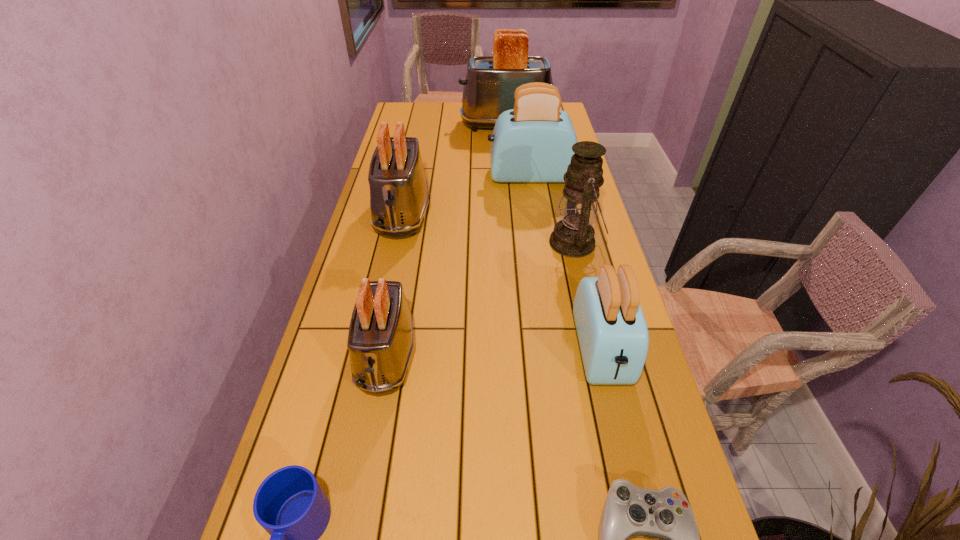
The height and width of the screenshot is (540, 960). Find the location of `the farthest gray toaster`. the farthest gray toaster is located at coordinates (491, 81).

At what (x,y) coordinates should I click in order to perform the action: click on the rightmost gray toaster. Please return your answer as a coordinate pair (x, y). The width and height of the screenshot is (960, 540). Looking at the image, I should click on (491, 81).

Find the location of a particular element. This screenshot has width=960, height=540. green oil lamp is located at coordinates click(573, 236).

The height and width of the screenshot is (540, 960). In order to click on the bigger light toaster in this screenshot , I will do `click(533, 142)`.

Locate an element on the screen. the second biggest gray toaster is located at coordinates (399, 196).

This screenshot has width=960, height=540. I want to click on the smaller light toaster, so pyautogui.click(x=613, y=336).

Where is `the smallest gray toaster`? the smallest gray toaster is located at coordinates (380, 341).

In order to click on vacant space located 0.080m on the side of the rightmost gray toaster with the control lever in this screenshot , I will do `click(442, 125)`.

Identify the location of blank space located on the side of the rightmost gray toaster with the control lever. (433, 125).

Where is `vacant area located on the side of the rightmost gray toaster with the control lever`? This screenshot has width=960, height=540. vacant area located on the side of the rightmost gray toaster with the control lever is located at coordinates (442, 125).